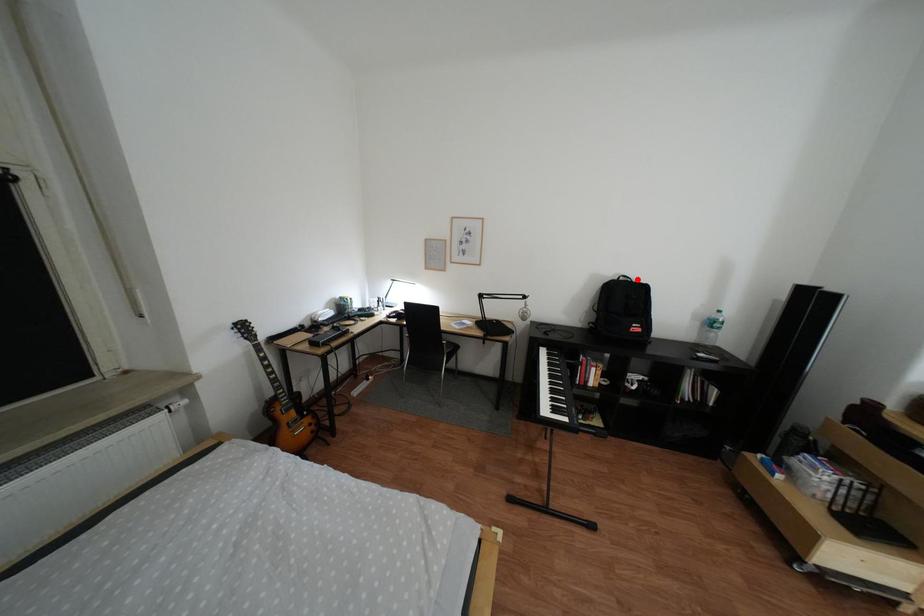
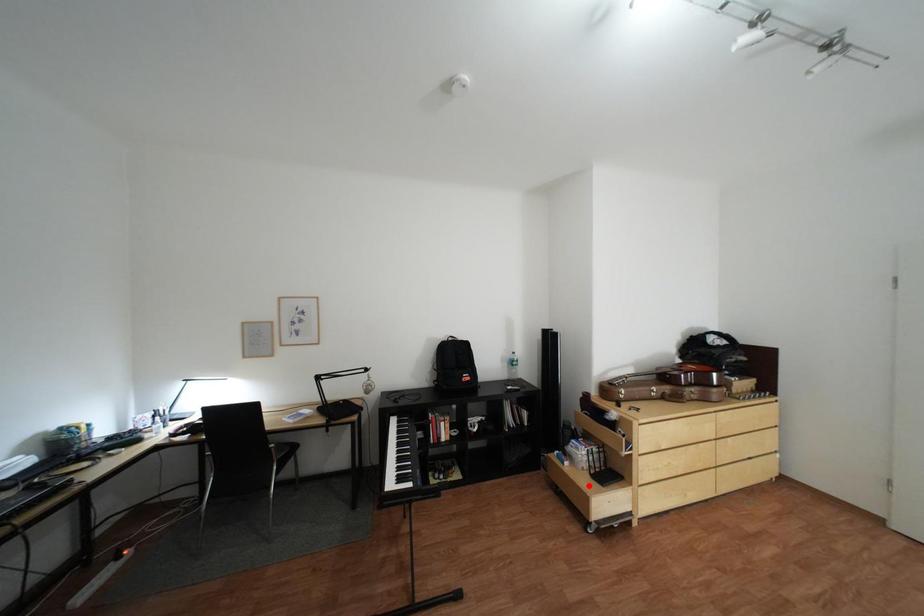
I am providing you with two images of the same scene from different viewpoints. A red point is marked on the first image and another point is marked on the second image. Do the highlighted points in image1 and image2 indicate the same real-world spot?

No